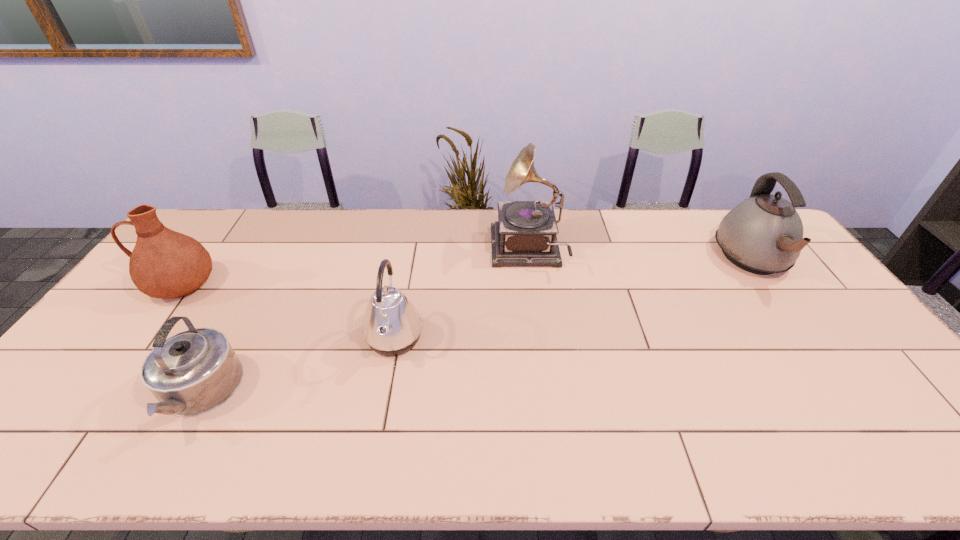
Where is `free spot located on the horn of the record player`? free spot located on the horn of the record player is located at coordinates (465, 251).

This screenshot has width=960, height=540. In order to click on vacant area situated 0.050m at the spout of the farthest kettle in this screenshot , I will do `click(786, 306)`.

Image resolution: width=960 pixels, height=540 pixels. Identify the location of free space located from the spout of the second kettle from left to right. (492, 339).

The image size is (960, 540). What are the coordinates of `record player at the far edge` in the screenshot? It's located at (525, 234).

Locate an element on the screen. Image resolution: width=960 pixels, height=540 pixels. kettle present at the far edge is located at coordinates (763, 234).

Locate an element on the screen. The height and width of the screenshot is (540, 960). object located in the near edge section of the desktop is located at coordinates (193, 372).

I want to click on object that is positioned at the left edge, so click(164, 264).

Identify the location of object at the right edge. This screenshot has height=540, width=960. (763, 234).

Find the location of a particular element. The width and height of the screenshot is (960, 540). object located at the far right corner is located at coordinates (763, 234).

Locate an element on the screen. vacant region at the far edge is located at coordinates (660, 216).